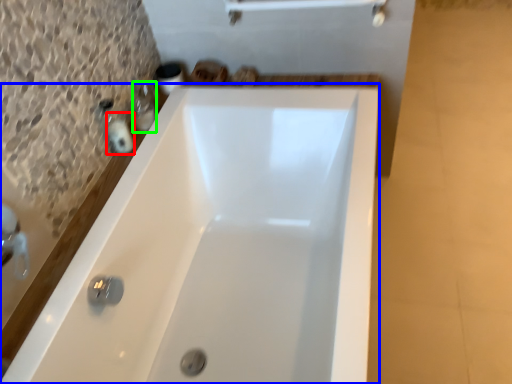
Question: Based on their relative distances, which object is farther from toiletry (highlighted by a red box)? Choose from bathtub (highlighted by a blue box) and toiletry (highlighted by a green box).

Choices:
 (A) bathtub
 (B) toiletry

Answer: (A)